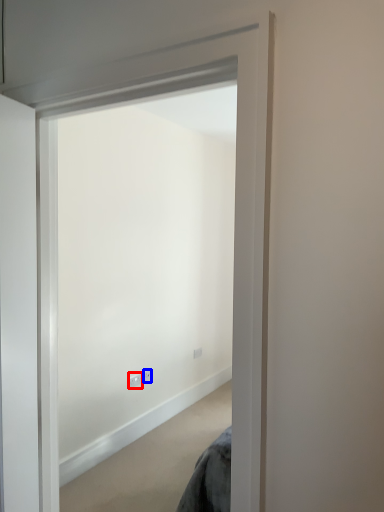
Question: Which object is closer to the camera taking this photo, electric outlet (highlighted by a red box) or electric outlet (highlighted by a blue box)?

Choices:
 (A) electric outlet
 (B) electric outlet

Answer: (A)